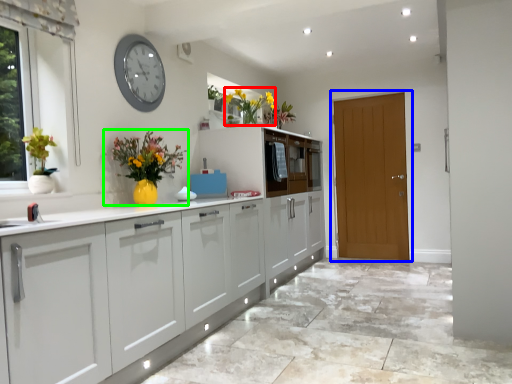
Question: Estimate the real-world distances between objects in this image. Which object is farther from floral arrangement (highlighted by a red box), door (highlighted by a blue box) or houseplant (highlighted by a green box)?

Choices:
 (A) door
 (B) houseplant

Answer: (A)